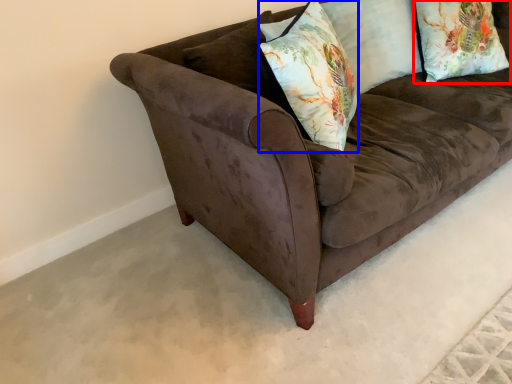
Question: Among these objects, which one is farthest to the camera, pillow (highlighted by a red box) or throw pillow (highlighted by a blue box)?

Choices:
 (A) pillow
 (B) throw pillow

Answer: (A)